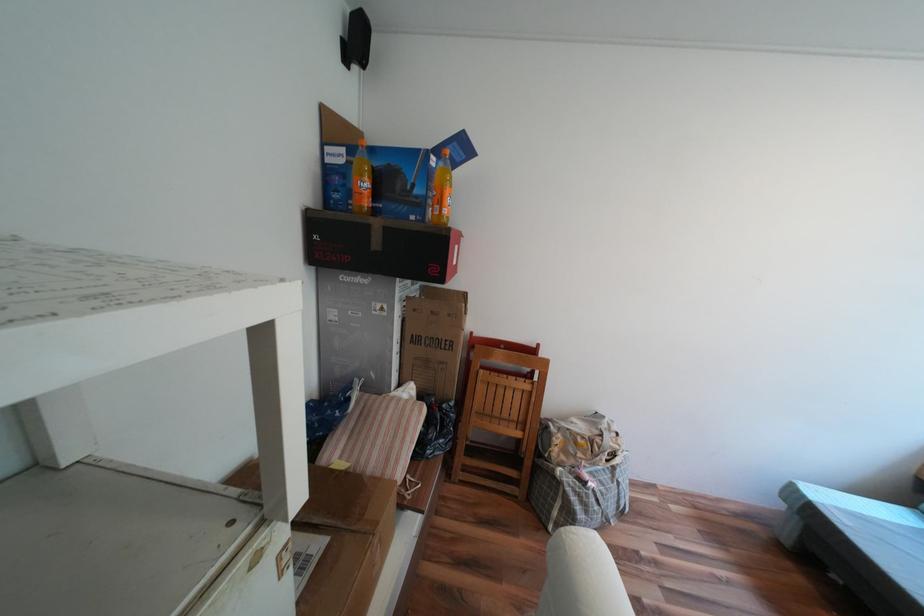
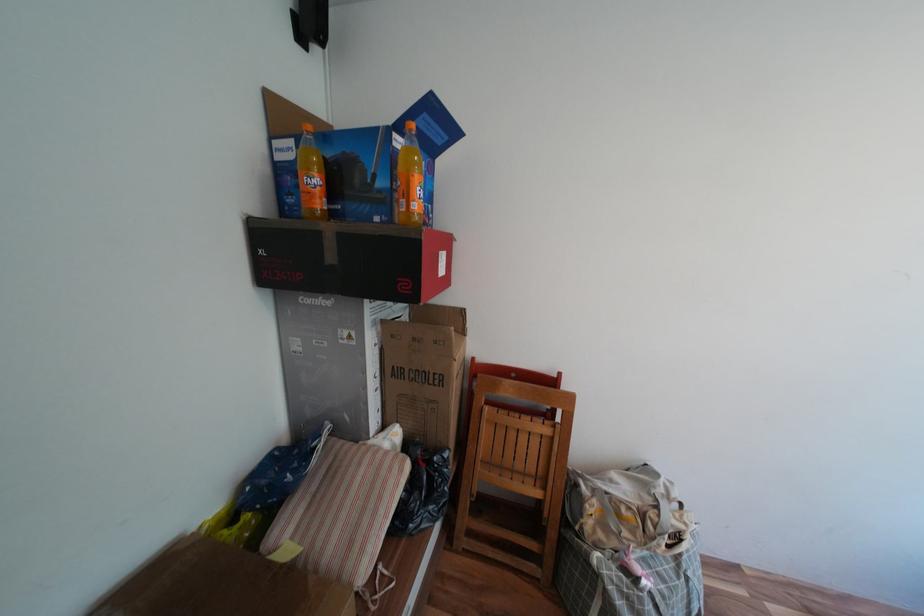
Question: How did the camera likely rotate?

Choices:
 (A) Left
 (B) Right
 (C) Up
 (D) Down

Answer: (A)